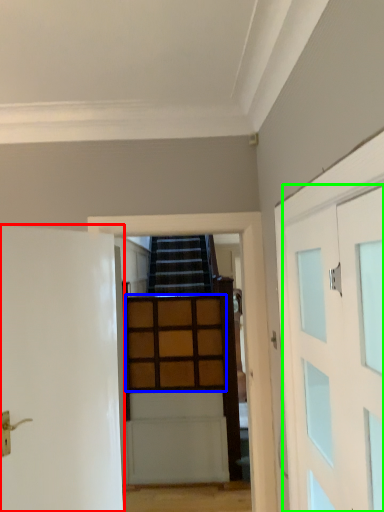
Question: Based on their relative distances, which object is nearer to door (highlighted by a red box)? Choose from cabinetry (highlighted by a blue box) and door (highlighted by a green box).

Choices:
 (A) cabinetry
 (B) door

Answer: (B)